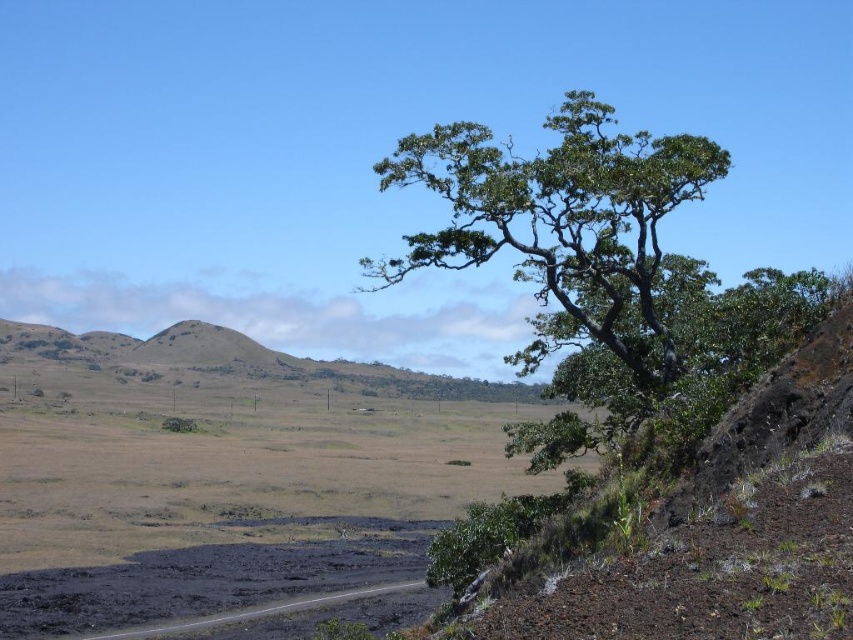
Is point (469, 230) positioned behind point (120, 632)?

No, (469, 230) is closer to viewer.

Is green leafy tree at upper right smaller than black asphalt road at lower left?

Actually, green leafy tree at upper right might be larger than black asphalt road at lower left.

Identify the location of green leafy tree at upper right. This screenshot has height=640, width=853. (596, 268).